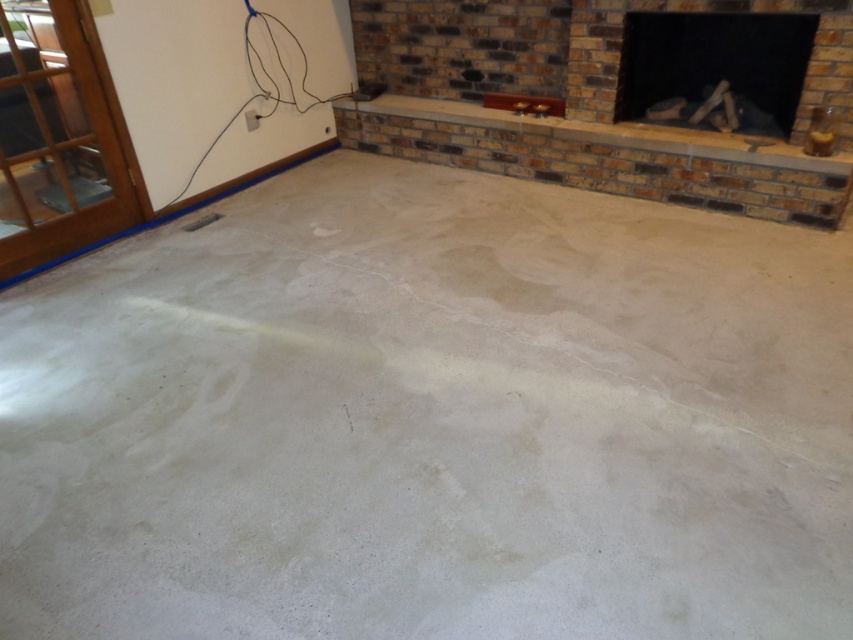
Question: Does brick fireplace at upper center appear under black brick fireplace at upper right?

Choices:
 (A) no
 (B) yes

Answer: (B)

Question: Can you confirm if brick fireplace at upper center is positioned below black brick fireplace at upper right?

Choices:
 (A) no
 (B) yes

Answer: (B)

Question: Observing the image, what is the correct spatial positioning of brick fireplace at upper center in reference to black brick fireplace at upper right?

Choices:
 (A) above
 (B) below

Answer: (B)

Question: Which of the following is the closest to the observer?

Choices:
 (A) (523, 145)
 (B) (639, 96)

Answer: (B)